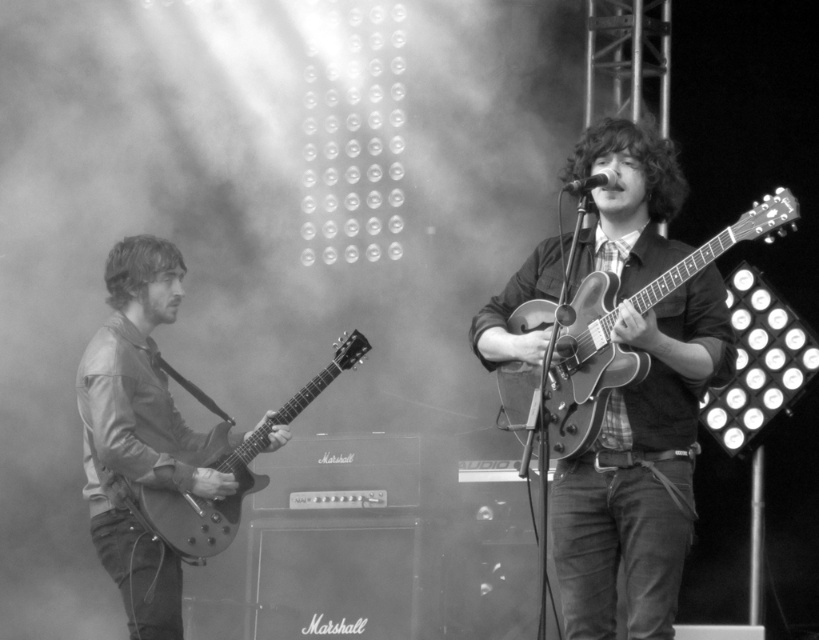
Question: Which object is positioned farthest from the matte guitar at center?

Choices:
 (A) matte wood guitar at center
 (B) matte black guitar at left

Answer: (B)

Question: Which of the following is the closest to the observer?

Choices:
 (A) matte black guitar at left
 (B) glossy wood guitar at left
 (C) matte guitar at center
 (D) matte wood guitar at center

Answer: (D)

Question: Observing the image, what is the correct spatial positioning of matte guitar at center in reference to glossy wood guitar at left?

Choices:
 (A) left
 (B) right

Answer: (B)

Question: Can you confirm if matte black guitar at left is thinner than glossy wood guitar at left?

Choices:
 (A) yes
 (B) no

Answer: (A)

Question: Can you confirm if matte wood guitar at center is positioned to the left of glossy wood guitar at left?

Choices:
 (A) yes
 (B) no

Answer: (B)

Question: Which object is farther from the camera taking this photo?

Choices:
 (A) matte wood guitar at center
 (B) matte black guitar at left
 (C) matte guitar at center

Answer: (B)